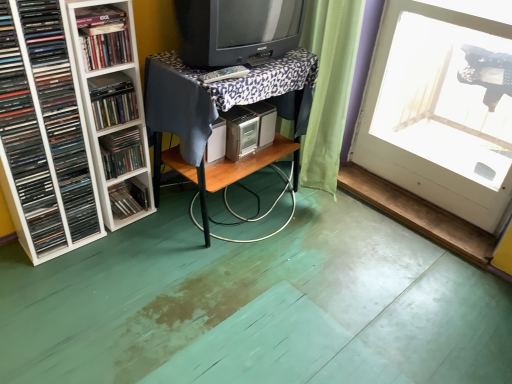
Find the location of a particular element. This screenshot has height=384, width=512. vacant region in front of wooden table at center, positioned as the second table in top-to-bottom order is located at coordinates (262, 296).